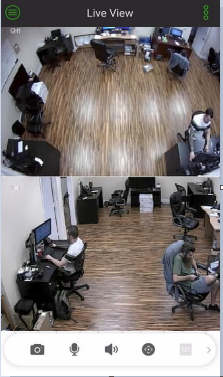
You are a GUI agent. You are given a task and a screenshot of the screen. Output one action in this format:
    pyautogui.click(x=<x>, y=<y>)
    Task: Click on the chair
    The height and width of the screenshot is (377, 223).
    Given the screenshot: What is the action you would take?
    pyautogui.click(x=77, y=280)